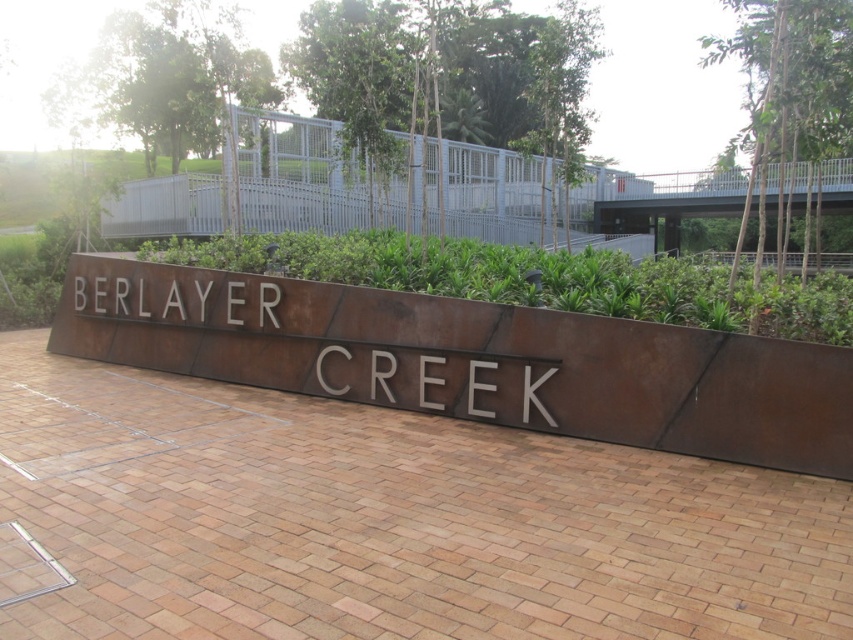
In the scene shown: Which is above, rusty metal sign at center or green leafy plants at center?

green leafy plants at center is higher up.

Between point (235, 368) and point (611, 307), which one is positioned in front?

Point (611, 307) is more forward.

Between point (320, 387) and point (323, 262), which one is positioned in front?

Point (320, 387)

What are the coordinates of `rusty metal sign at center` in the screenshot? It's located at (471, 358).